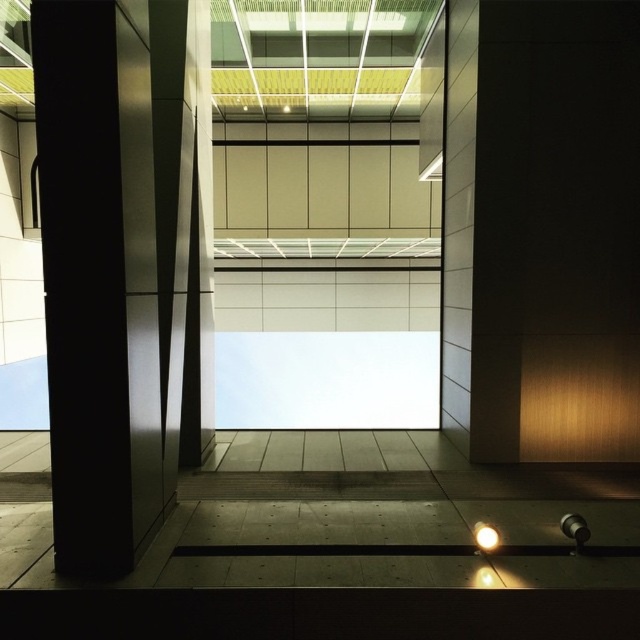
Does metallic at left lie behind white glossy light bulb at lower center?

No.

Is point (148, 200) farther from viewer compared to point (484, 524)?

Yes, it is.

Is point (156, 477) in front of point (483, 547)?

No, it is behind (483, 547).

Find the location of a particular element. This screenshot has height=640, width=640. metallic at left is located at coordinates (99, 284).